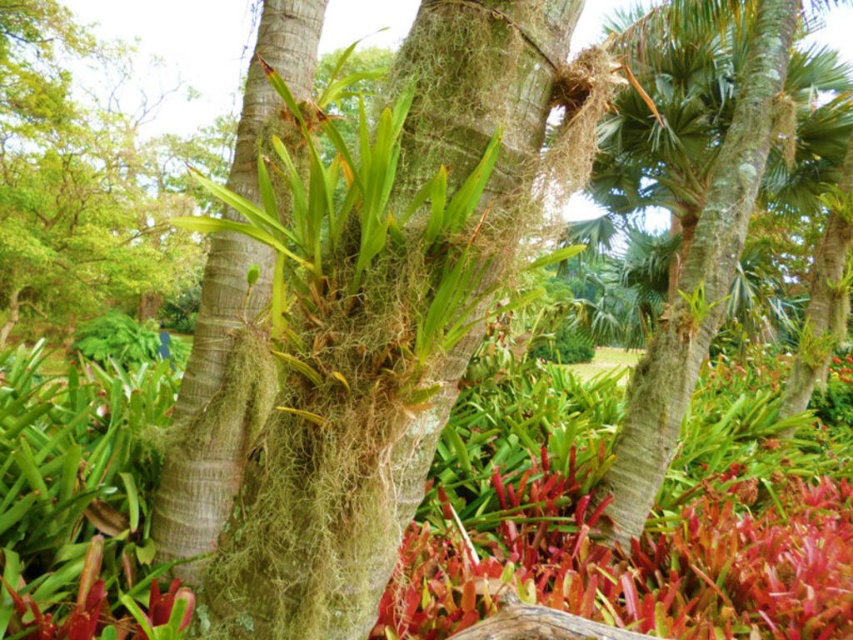
Does vivid red leaves at lower center appear under green mossy bark tree trunk at center?

Yes, vivid red leaves at lower center is below green mossy bark tree trunk at center.

You are a GUI agent. You are given a task and a screenshot of the screen. Output one action in this format:
    pyautogui.click(x=<x>, y=<y>)
    Task: Click on the vivid red leaves at lower center
    The height and width of the screenshot is (640, 853).
    Given the screenshot: What is the action you would take?
    pyautogui.click(x=637, y=563)

This screenshot has width=853, height=640. Identify the location of vivid red leaves at lower center. (637, 563).

The height and width of the screenshot is (640, 853). What are the coordinates of `vivid red leaves at lower center` in the screenshot? It's located at (637, 563).

Is vivid red leaves at lower center to the left of green mossy tree at center from the viewer's perspective?

No, vivid red leaves at lower center is not to the left of green mossy tree at center.

Describe the element at coordinates (637, 563) in the screenshot. Image resolution: width=853 pixels, height=640 pixels. I see `vivid red leaves at lower center` at that location.

This screenshot has height=640, width=853. Identify the location of vivid red leaves at lower center. (637, 563).

Does green mossy tree at center have a greater width compared to green mossy bark tree trunk at center?

Indeed, green mossy tree at center has a greater width compared to green mossy bark tree trunk at center.

Can you confirm if green mossy tree at center is bigger than green mossy bark tree trunk at center?

Yes.

This screenshot has height=640, width=853. Describe the element at coordinates (77, 184) in the screenshot. I see `green mossy tree at center` at that location.

Where is `green mossy tree at center`? The height and width of the screenshot is (640, 853). green mossy tree at center is located at coordinates point(77,184).